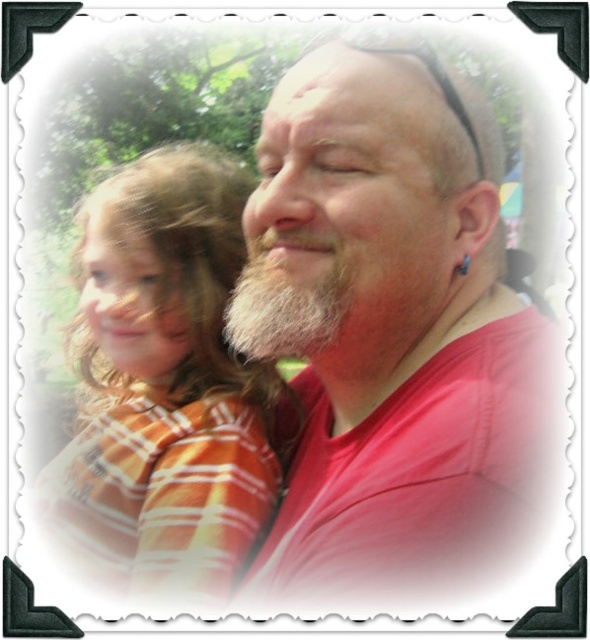
You are a photographer trying to capture the orange striped shirt at left in the frame. Based on its position at point 0.600, 0.281, should you adjust your camera to the left or right to center it?

The orange striped shirt at left is located at point (165, 384), so to center it, you should adjust your camera to the right since the x coordinate is 0.6, which is to the right of the center at 0.5.

You are a photographer holding a camera. You want to take a photo of the white beard at center so that it fills the frame perfectly. The camera you are using has a minimum focusing distance of 24 inches. Will you be able to achieve this without moving closer?

The white beard at center is 23.05 inches away from the camera, which is closer than the minimum focusing distance of 24 inches. Therefore, you cannot achieve this without moving further back.